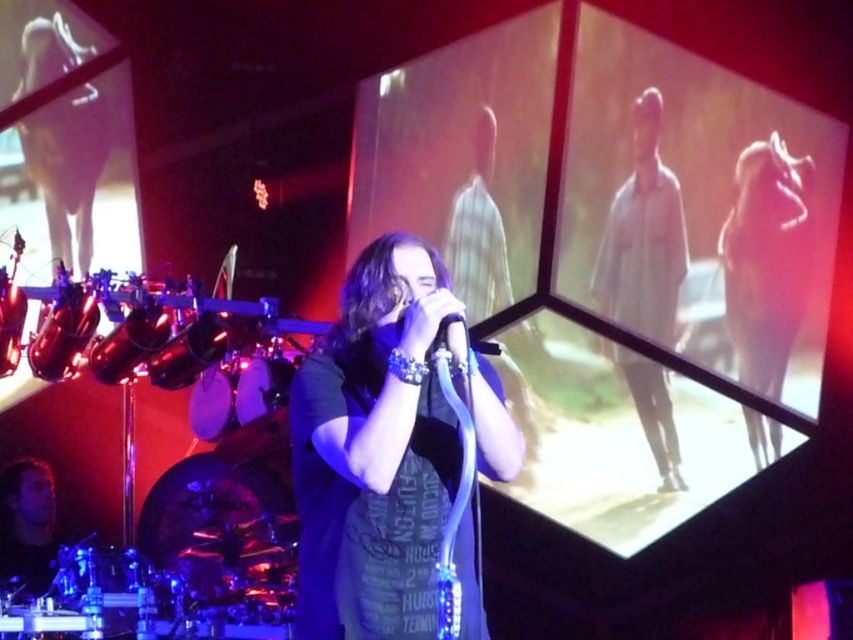
Question: Which object appears closest to the camera in this image?

Choices:
 (A) dark blue t-shirt at center
 (B) white matte dress at upper center

Answer: (A)

Question: In this image, where is dark blue t-shirt at center located relative to white matte dress at upper center?

Choices:
 (A) right
 (B) left

Answer: (B)

Question: Does dark blue t-shirt at center appear under white matte dress at upper center?

Choices:
 (A) yes
 (B) no

Answer: (A)

Question: Which of the following is the farthest from the observer?

Choices:
 (A) (663, 257)
 (B) (306, 440)

Answer: (A)

Question: Is the position of dark blue t-shirt at center less distant than that of white matte dress at upper center?

Choices:
 (A) yes
 (B) no

Answer: (A)